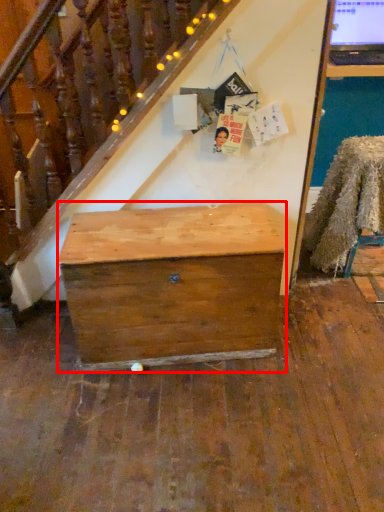
Question: From the image's perspective, what is the correct spatial relationship of desk (annotated by the red box) in relation to chair?

Choices:
 (A) above
 (B) below

Answer: (B)